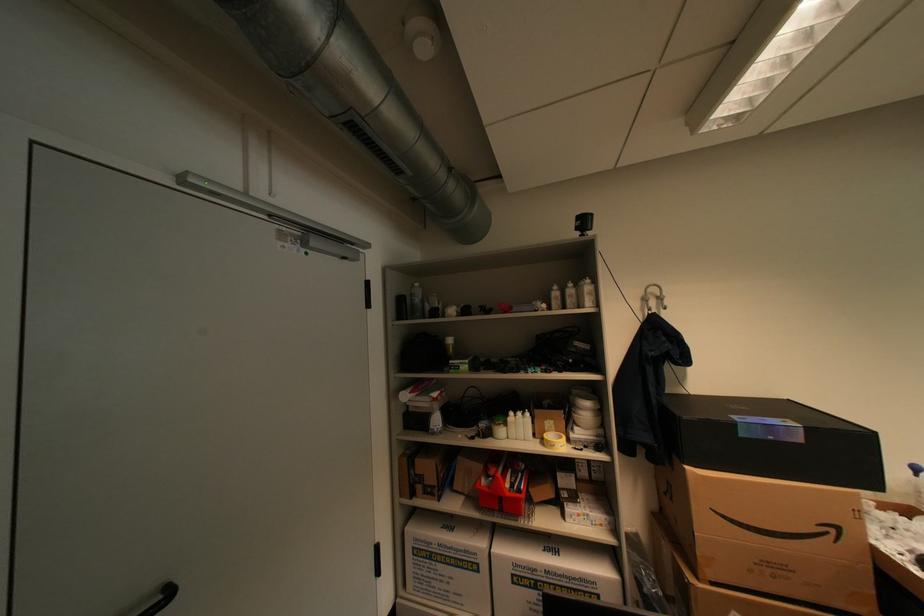
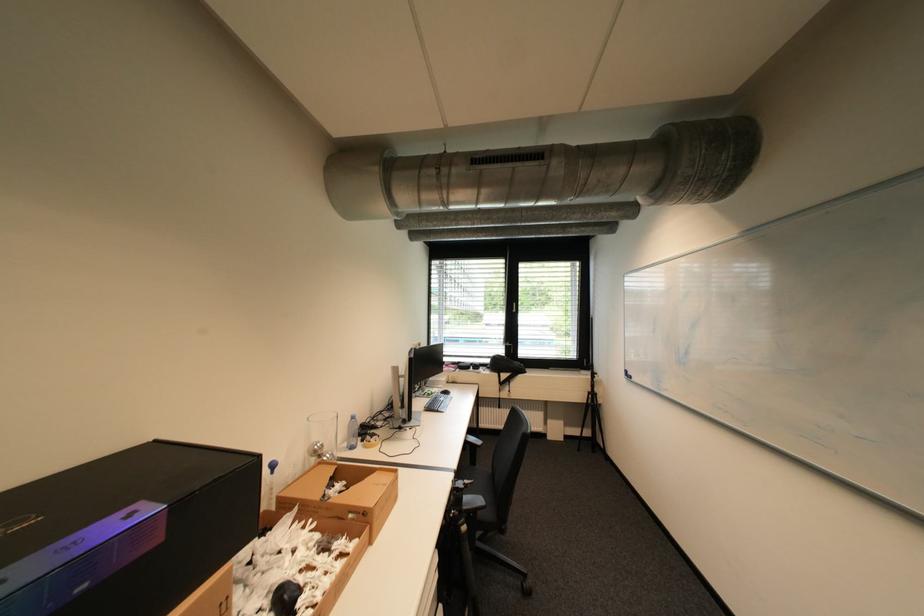
Question: The camera is either moving clockwise (left) or counter-clockwise (right) around the object. The first image is from the beginning of the video and the second image is from the end. Is the camera moving left or right when shooting the video?

Choices:
 (A) Left
 (B) Right

Answer: (A)